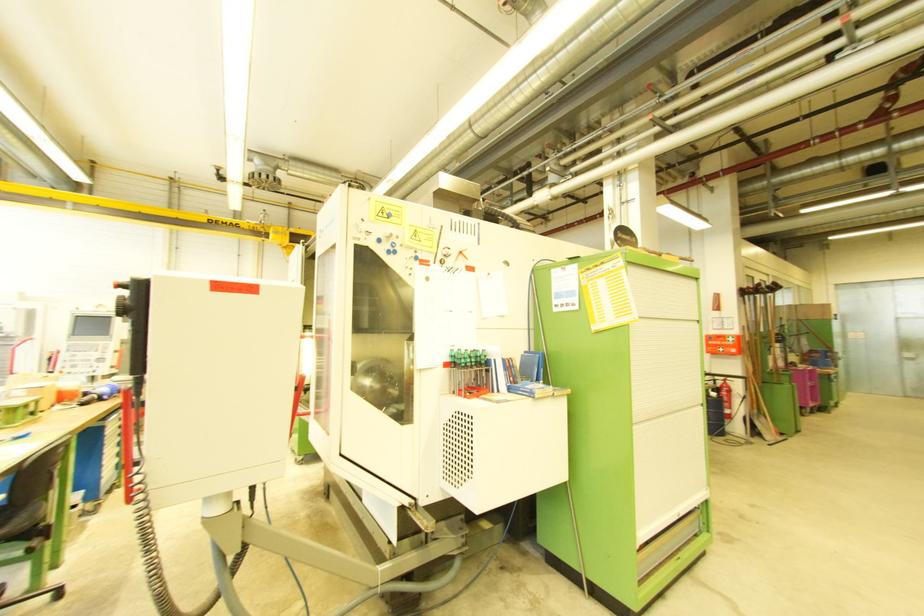
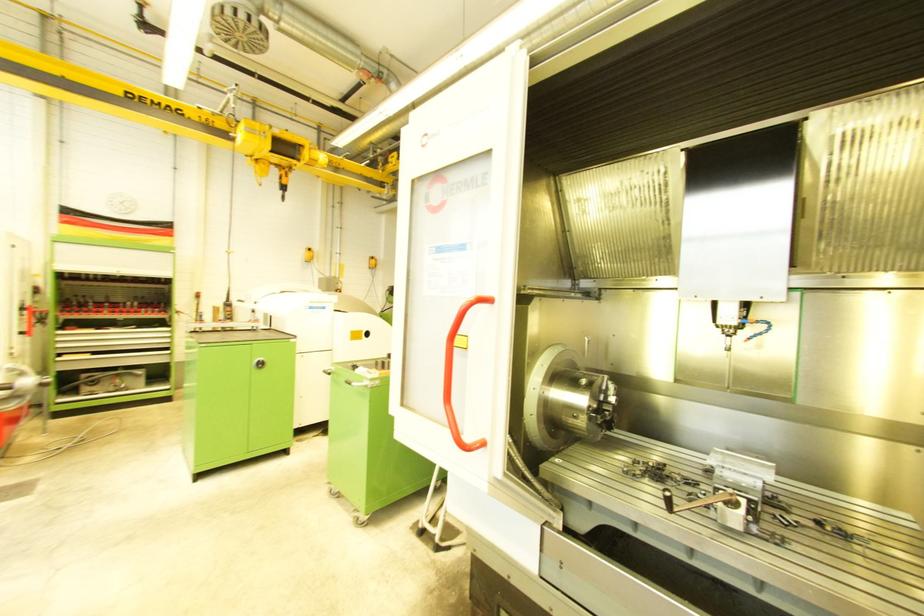
Which direction would the cameraman need to move to produce the second image?

The cameraman moved toward left, forward.